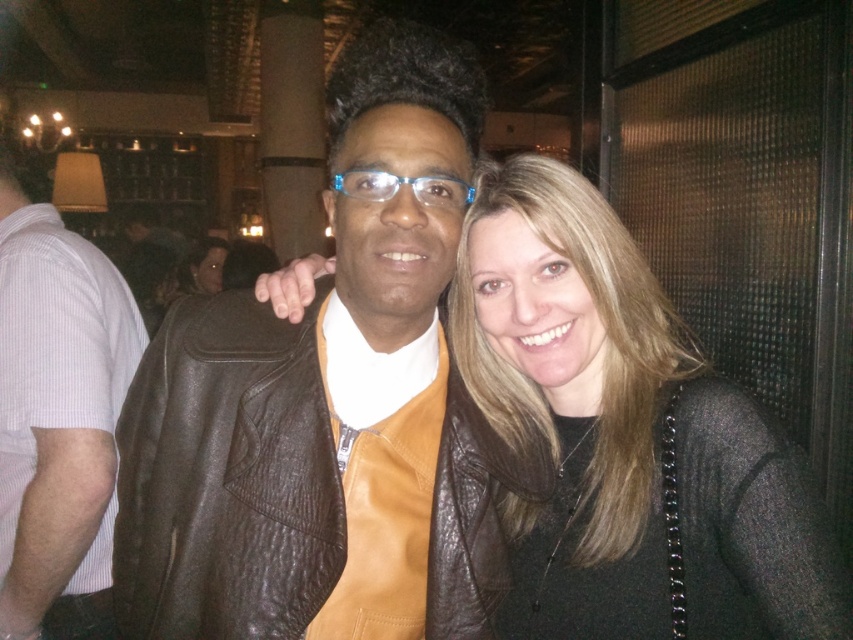
You are standing in front of the image and want to describe the position of the brown leather jacket at center. What are its coordinates?

The brown leather jacket at center is located at coordinates point (291, 369).

You are standing 40 inches away from the point marked as point (838,564). Can you reach it with your hand?

The distance of point (838,564) from viewer is 38.83 inches, so yes, you can reach it with your hand since it is closer than 40 inches.